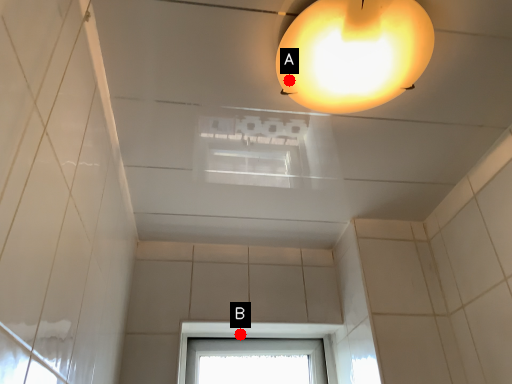
Question: Two points are circled on the image, labeled by A and B beside each circle. Which point appears closest to the camera in this image?

Choices:
 (A) A is closer
 (B) B is closer

Answer: (A)